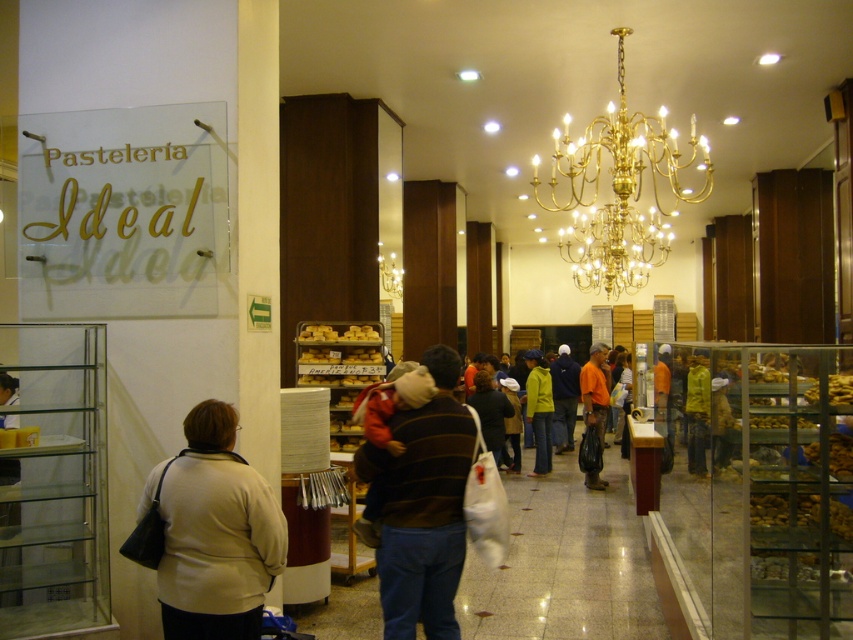
Question: Does brown striped sweater at center come in front of matte yellow jacket at center?

Choices:
 (A) yes
 (B) no

Answer: (A)

Question: In this image, where is brown striped sweater at center located relative to gold polished chandelier at upper center?

Choices:
 (A) above
 (B) below

Answer: (B)

Question: Is beige sweater at lower left bigger than matte yellow jacket at center?

Choices:
 (A) no
 (B) yes

Answer: (A)

Question: Among these objects, which one is farthest from the camera?

Choices:
 (A) orange fabric bag at center
 (B) matte yellow jacket at center

Answer: (B)

Question: Based on their relative distances, which object is nearer to the matte yellow jacket at center?

Choices:
 (A) orange fabric bag at center
 (B) brown striped sweater at center
 (C) gold polished chandelier at upper center
 (D) beige sweater at lower left

Answer: (A)

Question: Estimate the real-world distances between objects in this image. Which object is closer to the brown striped sweater at center?

Choices:
 (A) gold polished chandelier at upper center
 (B) matte yellow jacket at center
 (C) orange fabric bag at center

Answer: (A)